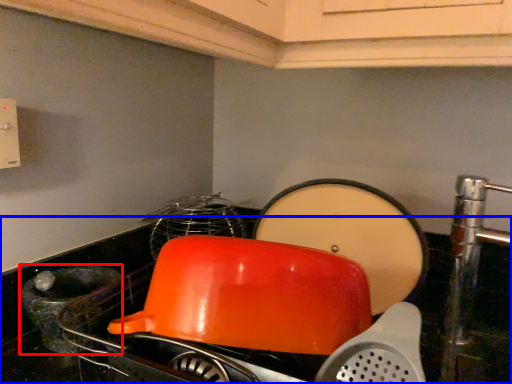
Question: Which object appears farthest to the camera in this image, appliance (highlighted by a red box) or counter top (highlighted by a blue box)?

Choices:
 (A) appliance
 (B) counter top

Answer: (A)